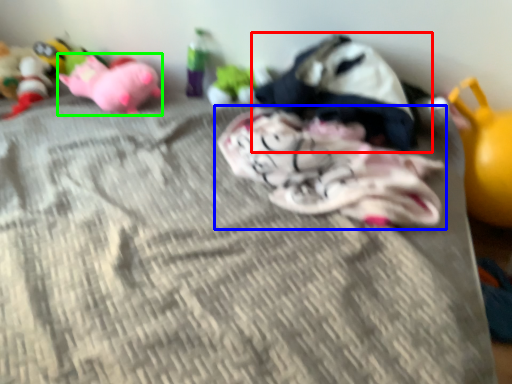
Question: Estimate the real-world distances between objects in this image. Which object is closer to toy (highlighted by a red box), toy (highlighted by a blue box) or toy (highlighted by a green box)?

Choices:
 (A) toy
 (B) toy

Answer: (A)